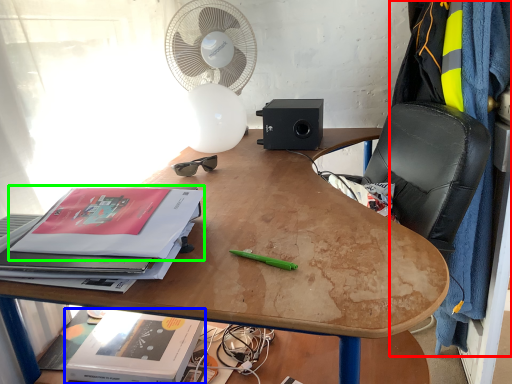
Question: Estimate the real-world distances between objects in this image. Which object is closer to blanket (highlighted by a red box), paperback book (highlighted by a blue box) or paperback book (highlighted by a green box)?

Choices:
 (A) paperback book
 (B) paperback book

Answer: (B)